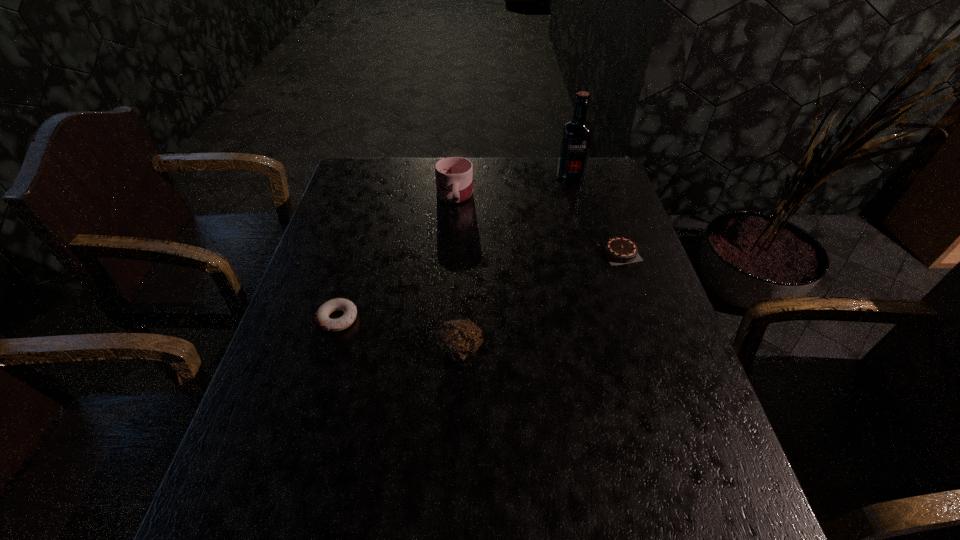
Locate an element on the screen. The height and width of the screenshot is (540, 960). unoccupied position between the chocolate cake and the muffin is located at coordinates (540, 301).

Select which object appears as the closest to the mug. Please provide its 2D coordinates. Your answer should be formatted as a tuple, i.e. [(x, y)], where the tuple contains the x and y coordinates of a point satisfying the conditions above.

[(576, 137)]

You are a GUI agent. You are given a task and a screenshot of the screen. Output one action in this format:
    pyautogui.click(x=<x>, y=<y>)
    Task: Click on the object that can be found as the closest to the chocolate cake
    
    Given the screenshot: What is the action you would take?
    pyautogui.click(x=576, y=137)

You are a GUI agent. You are given a task and a screenshot of the screen. Output one action in this format:
    pyautogui.click(x=<x>, y=<y>)
    Task: Click on the free spot that satisfies the following two spatial constraints: 1. on the front-facing side of the tallest object; 2. on the right side of the third farthest object
    The image size is (960, 540).
    Given the screenshot: What is the action you would take?
    pyautogui.click(x=589, y=252)

The height and width of the screenshot is (540, 960). I want to click on vacant position in the image that satisfies the following two spatial constraints: 1. on the front-facing side of the tallest object; 2. on the right side of the third farthest object, so click(589, 252).

The image size is (960, 540). I want to click on blank space that satisfies the following two spatial constraints: 1. on the side with the handle of the mug; 2. on the right side of the third farthest object, so click(450, 252).

Locate an element on the screen. The height and width of the screenshot is (540, 960). free space that satisfies the following two spatial constraints: 1. on the side with the handle of the third tallest object; 2. on the right side of the second tallest object is located at coordinates (444, 350).

You are a GUI agent. You are given a task and a screenshot of the screen. Output one action in this format:
    pyautogui.click(x=<x>, y=<y>)
    Task: Click on the free point that satisfies the following two spatial constraints: 1. on the back side of the third farthest object; 2. on the right side of the third tallest object
    Image resolution: width=960 pixels, height=540 pixels.
    Given the screenshot: What is the action you would take?
    pyautogui.click(x=464, y=252)